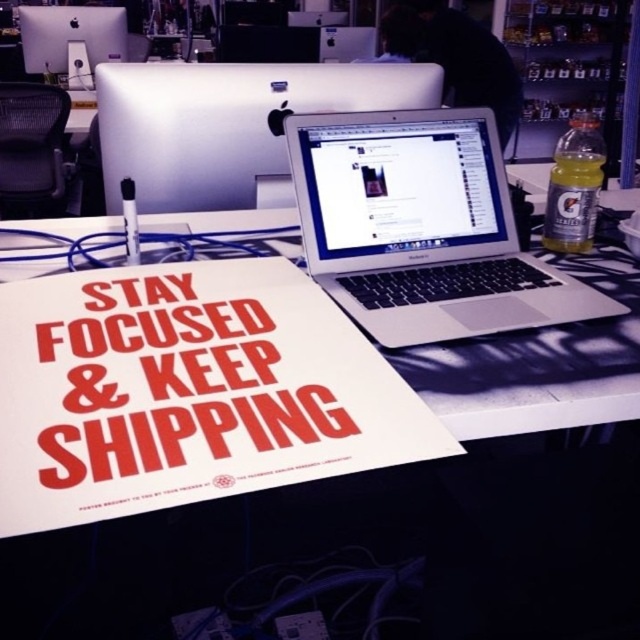
You are a delivery person who needs to place a 3.5 meters long package on the desk. Based on the distance between the white plastic desk at center and the matte black monitor at upper left, can you safely place the package without it extending beyond the desk?

The white plastic desk at center is 3.11 meters away from the matte black monitor at upper left. Since the package is 3.5 meters long, which is longer than the distance between the desk and the monitor, placing it might cause the package to extend beyond the desk towards the monitor, making it unsafe.

Based on the photo, you are an office worker who needs to place a 15 cm wide USB hub between the sleek silver monitor at upper center and the matte black monitor at upper left. Can you fit it there without overlapping either monitor?

The sleek silver monitor at upper center has a lesser width compared to matte black monitor at upper left, but the exact distance between them isn t provided. Without knowing the space between the two monitors, it s impossible to determine if the USB hub will fit.

You are organizing a desk and need to place a new keyboard that requires 15 inches of space. You have two items on the desk, the sleek silver laptop at center and the sleek silver monitor at upper center. Which item should you move to make space for the keyboard?

You should move the sleek silver laptop at center since it has a larger size compared to the sleek silver monitor at upper center, making it easier to relocate to free up the required space.